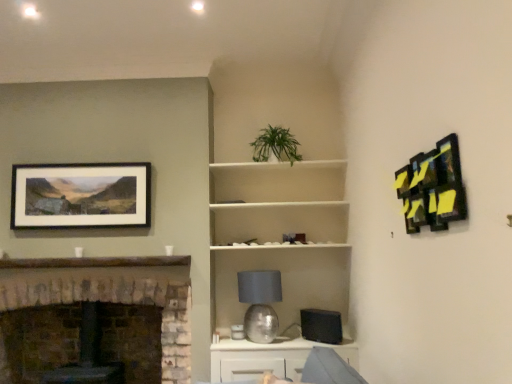
This screenshot has height=384, width=512. What are the coordinates of `abstract painting at upper right, placed as the 2th picture frame when sorted from back to front` in the screenshot? It's located at (433, 187).

The height and width of the screenshot is (384, 512). Describe the element at coordinates (260, 303) in the screenshot. I see `silver metallic table lamp at center` at that location.

This screenshot has height=384, width=512. What do you see at coordinates (278, 221) in the screenshot?
I see `white matte shelf at center` at bounding box center [278, 221].

Find the location of a particular element. This screenshot has width=512, height=384. white matte shelf at center is located at coordinates [x=278, y=221].

The height and width of the screenshot is (384, 512). What do you see at coordinates (81, 195) in the screenshot?
I see `matte black picture frame at upper left, the second picture frame from the right` at bounding box center [81, 195].

Where is `abstract painting at upper right, positioned as the first picture frame in front-to-back order`? abstract painting at upper right, positioned as the first picture frame in front-to-back order is located at coordinates (433, 187).

Measure the distance between white matte shelf at center and stone fireplace at left.

The distance of white matte shelf at center from stone fireplace at left is 34.74 inches.

Considering the points (211, 226) and (2, 382), which point is in front, point (211, 226) or point (2, 382)?

The point (2, 382) is closer to the camera.

From a real-world perspective, which object stands above the other?

In real-world perspective, white matte shelf at center is above.

Locate an element on the screen. The height and width of the screenshot is (384, 512). shelf behind the stone fireplace at left is located at coordinates (278, 221).

Can you confirm if abstract painting at upper right, placed as the 2th picture frame when sorted from back to front, is taller than green leafy plant at upper center?

Yes, abstract painting at upper right, placed as the 2th picture frame when sorted from back to front, is taller than green leafy plant at upper center.

From the image's perspective, between abstract painting at upper right, which is the 1th picture frame from right to left, and green leafy plant at upper center, which one is located above?

green leafy plant at upper center is shown above in the image.

Considering the positions of objects abstract painting at upper right, which is the 1th picture frame from right to left, and green leafy plant at upper center in the image provided, who is more to the left, abstract painting at upper right, which is the 1th picture frame from right to left, or green leafy plant at upper center?

green leafy plant at upper center is more to the left.

Looking at this image, measure the distance from green leafy plant at upper center to silver metallic table lamp at center.

The distance of green leafy plant at upper center from silver metallic table lamp at center is 3.52 feet.

Considering the sizes of objects green leafy plant at upper center and silver metallic table lamp at center in the image provided, who is wider, green leafy plant at upper center or silver metallic table lamp at center?

green leafy plant at upper center.

Does point (291, 162) appear closer or farther from the camera than point (258, 290)?

Point (291, 162) appears to be farther away from the viewer than point (258, 290).

Is white matte shelf at center next to matte black picture frame at upper left, the second picture frame from the right?

No.

Measure the distance from white matte shelf at center to matte black picture frame at upper left, the second picture frame from the front.

white matte shelf at center and matte black picture frame at upper left, the second picture frame from the front, are 3.34 feet apart.

In the scene shown: Between white matte shelf at center and matte black picture frame at upper left, acting as the first picture frame starting from the left, which one is positioned behind?

Positioned behind is matte black picture frame at upper left, acting as the first picture frame starting from the left.

Which point is more forward, (313,237) or (49,168)?

The point (49,168) is in front.

This screenshot has height=384, width=512. Identify the location of picture frame that is the 1st object located above the stone fireplace at left (from the image's perspective). (81, 195).

Is point (50, 203) positioned in front of point (1, 288)?

No, it is not.

Looking at their sizes, would you say matte black picture frame at upper left, which is counted as the first picture frame, starting from the back, is wider or thinner than stone fireplace at left?

Clearly, matte black picture frame at upper left, which is counted as the first picture frame, starting from the back, has less width compared to stone fireplace at left.

Can you tell me how much abstract painting at upper right, placed as the 2th picture frame when sorted from back to front, and white matte shelf at center differ in facing direction?

The angular difference between abstract painting at upper right, placed as the 2th picture frame when sorted from back to front, and white matte shelf at center is 89.1 degrees.

Who is bigger, abstract painting at upper right, the 2th picture frame viewed from the left, or white matte shelf at center?

white matte shelf at center is bigger.

Are abstract painting at upper right, positioned as the first picture frame in front-to-back order, and white matte shelf at center far apart?

abstract painting at upper right, positioned as the first picture frame in front-to-back order, is positioned a significant distance from white matte shelf at center.

Considering the relative sizes of white matte shelf at center and white glossy cabinet at lower center in the image provided, is white matte shelf at center smaller than white glossy cabinet at lower center?

Incorrect, white matte shelf at center is not smaller in size than white glossy cabinet at lower center.

How many degrees apart are the facing directions of white matte shelf at center and white glossy cabinet at lower center?

There is a 1.53-degree angle between the facing directions of white matte shelf at center and white glossy cabinet at lower center.

Is white matte shelf at center not inside white glossy cabinet at lower center?

That's correct, white matte shelf at center is outside of white glossy cabinet at lower center.

Is white matte shelf at center positioned behind white glossy cabinet at lower center?

Yes, white matte shelf at center is further from the viewer.

Where is `shelf on the right of the stone fireplace at left`? This screenshot has width=512, height=384. shelf on the right of the stone fireplace at left is located at coordinates (278, 221).

At what (x,y) coordinates should I click in order to perform the action: click on houseplant above the abstract painting at upper right, positioned as the first picture frame in front-to-back order (from a real-world perspective). Please return your answer as a coordinate pair (x, y). Looking at the image, I should click on (275, 145).

Estimate the real-world distances between objects in this image. Which object is closer to silver metallic table lamp at center, white matte shelf at center or stone fireplace at left?

white matte shelf at center is positioned closer to the anchor silver metallic table lamp at center.

Looking at this image, considering their positions, is white matte shelf at center positioned further to white glossy cabinet at lower center than green leafy plant at upper center?

The object further to white glossy cabinet at lower center is green leafy plant at upper center.

Based on their spatial positions, is silver metallic table lamp at center or stone fireplace at left closer to white glossy cabinet at lower center?

silver metallic table lamp at center is positioned closer to the anchor white glossy cabinet at lower center.

Based on their spatial positions, is abstract painting at upper right, placed as the 2th picture frame when sorted from back to front, or green leafy plant at upper center closer to silver metallic table lamp at center?

Based on the image, green leafy plant at upper center appears to be nearer to silver metallic table lamp at center.

Based on their spatial positions, is matte black picture frame at upper left, which is counted as the first picture frame, starting from the back, or white glossy cabinet at lower center closer to stone fireplace at left?

Among the two, matte black picture frame at upper left, which is counted as the first picture frame, starting from the back, is located nearer to stone fireplace at left.

Consider the image. Looking at the image, which one is located further to green leafy plant at upper center, matte black picture frame at upper left, acting as the first picture frame starting from the left, or stone fireplace at left?

Among the two, stone fireplace at left is located further to green leafy plant at upper center.

Based on the photo, looking at the image, which one is located closer to matte black picture frame at upper left, the second picture frame from the front, white glossy cabinet at lower center or abstract painting at upper right, which is the 1th picture frame from right to left?

white glossy cabinet at lower center is positioned closer to the anchor matte black picture frame at upper left, the second picture frame from the front.

Considering their positions, is white glossy cabinet at lower center positioned further to stone fireplace at left than matte black picture frame at upper left, the second picture frame from the right?

white glossy cabinet at lower center lies further to stone fireplace at left than the other object.

Locate an element on the screen. The width and height of the screenshot is (512, 384). table lamp between green leafy plant at upper center and white glossy cabinet at lower center in the up-down direction is located at coordinates (260, 303).

Find the location of a particular element. Image resolution: width=512 pixels, height=384 pixels. fireplace between matte black picture frame at upper left, acting as the first picture frame starting from the left, and abstract painting at upper right, which is the 1th picture frame from right to left, from left to right is located at coordinates (111, 294).

You are a GUI agent. You are given a task and a screenshot of the screen. Output one action in this format:
    pyautogui.click(x=<x>, y=<y>)
    Task: Click on the houseplant between stone fireplace at left and white matte shelf at center in the horizontal direction
    The image size is (512, 384).
    Given the screenshot: What is the action you would take?
    pyautogui.click(x=275, y=145)

You are a GUI agent. You are given a task and a screenshot of the screen. Output one action in this format:
    pyautogui.click(x=<x>, y=<y>)
    Task: Click on the table lamp between stone fireplace at left and abstract painting at upper right, the 2th picture frame viewed from the left, in the horizontal direction
    Image resolution: width=512 pixels, height=384 pixels.
    Given the screenshot: What is the action you would take?
    pyautogui.click(x=260, y=303)